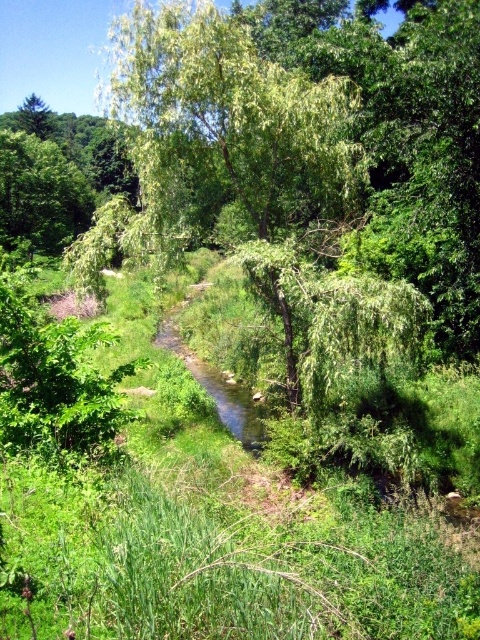
You are a hiker trying to cross the stream. You notice the green leafy grass at center and the clear water stream at center. Which one is shorter in height?

The green leafy grass at center is not as tall as the clear water stream at center, so the green leafy grass at center is shorter in height.

You are standing in the serene natural scene with the stream and willow tree. There are two points marked in the image. One is at coordinate point (x=255, y=605) and the other is at point (x=207, y=285). Which of these two points is closer to you?

Point (x=255, y=605) is closer to the viewer than point (x=207, y=285).

You are standing in the natural scene and want to take a photo of the green leafy tree at center. If your camera has a maximum zoom range of 10 meters, will you be able to capture the tree clearly without moving closer?

The green leafy tree at center is 11.32 meters away from the viewer. Since the camera can only zoom up to 10 meters, you won cannot capture the tree clearly without moving closer.